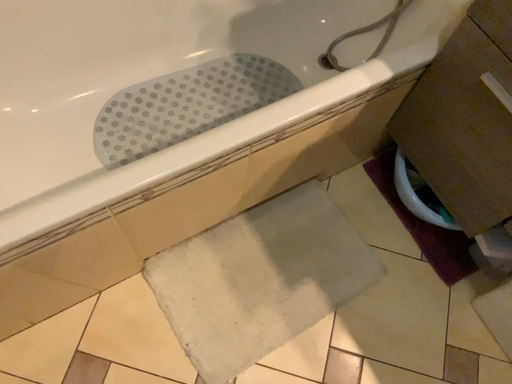
The image size is (512, 384). In order to click on vacant space that's between purple fabric bath mat at lower right, positioned as the first bath mat in right-to-left order, and white soft bath mat at lower center, which ranks as the first bath mat in left-to-right order in this screenshot , I will do `click(368, 261)`.